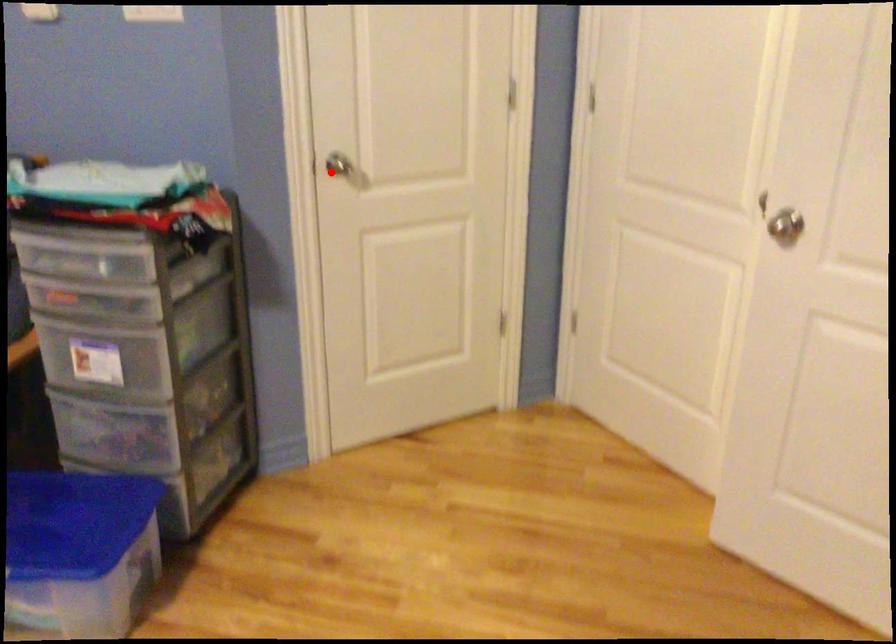
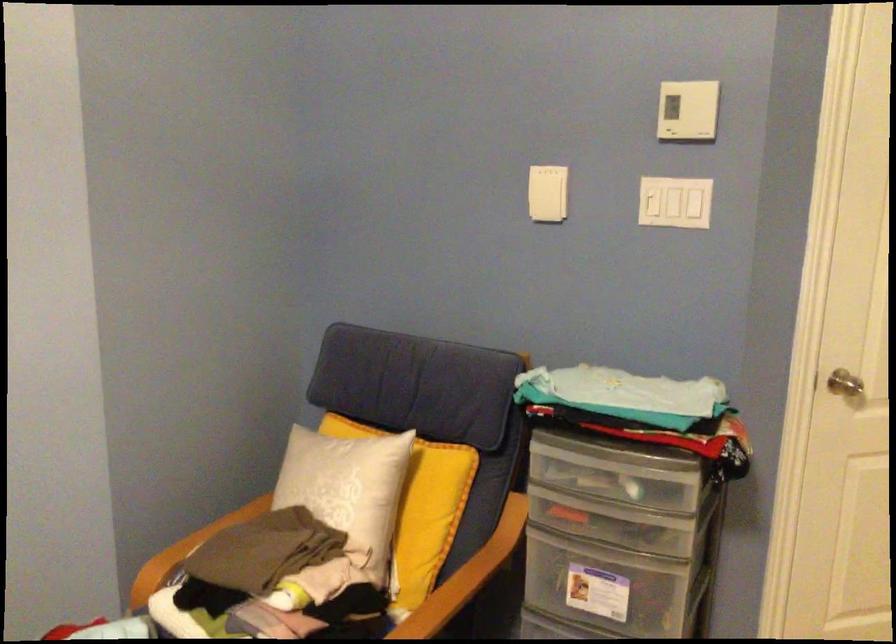
Find the pixel in the second image that matches the highlighted location in the first image.

(846, 384)